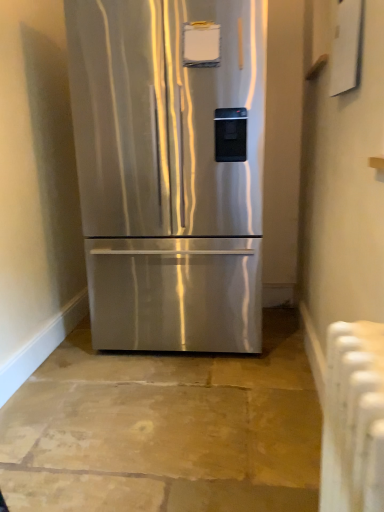
This screenshot has height=512, width=384. I want to click on free space in front of stainless steel refrigerator at center, so click(x=174, y=424).